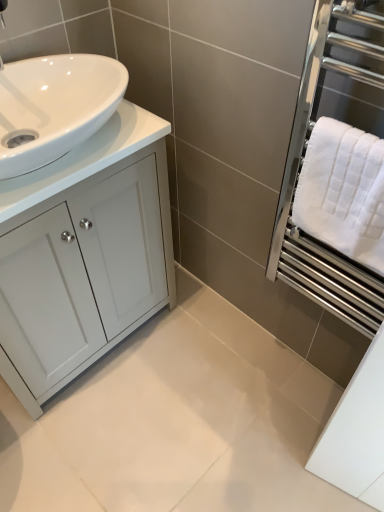
Locate an element on the screen. This screenshot has width=384, height=512. white glossy countertop at left is located at coordinates (84, 158).

The image size is (384, 512). Describe the element at coordinates (343, 191) in the screenshot. I see `white textured towel at right` at that location.

You are a GUI agent. You are given a task and a screenshot of the screen. Output one action in this format:
    pyautogui.click(x=<x>, y=<y>)
    Task: Click on the white glossy cabinet at left
    
    Given the screenshot: What is the action you would take?
    pyautogui.click(x=84, y=254)

Where is `bathroom cabinet behind the white textured towel at right`? bathroom cabinet behind the white textured towel at right is located at coordinates (84, 254).

Is white glossy cabinet at left oriented away from white textured towel at right?

white glossy cabinet at left does not have its back to white textured towel at right.

Does point (53, 181) come behind point (315, 128)?

Yes, point (53, 181) is behind point (315, 128).

Considering the relative positions of white glossy cabinet at left and white textured towel at right in the image provided, is white glossy cabinet at left in front of white textured towel at right?

No, white glossy cabinet at left is further to the viewer.

Looking at this image, is white glossy countertop at left further to camera compared to white textured towel at right?

Yes, white glossy countertop at left is further from the viewer.

From a real-world perspective, does white glossy countertop at left stand above white textured towel at right?

Correct, in the physical world, white glossy countertop at left is higher than white textured towel at right.

Does point (93, 141) appear closer or farther from the camera than point (362, 330)?

Point (93, 141) is closer to the camera than point (362, 330).

The height and width of the screenshot is (512, 384). Identify the location of screen door to the right of white glossy cabinet at left. (305, 154).

Considering the sizes of objects white glossy cabinet at left and white textured towel at right in the image provided, who is taller, white glossy cabinet at left or white textured towel at right?

white glossy cabinet at left.

From a real-world perspective, which object rests below the other?

white glossy cabinet at left is physically lower.

From the image's perspective, is white glossy cabinet at left under white textured towel at right?

Yes, from the image's perspective, white glossy cabinet at left is beneath white textured towel at right.

Does point (294, 134) lie in front of point (145, 249)?

Yes.

Considering the relative sizes of white textured towel at right and white glossy cabinet at left in the image provided, is white textured towel at right smaller than white glossy cabinet at left?

Yes.

Is white textured towel at right closer to the viewer compared to white glossy cabinet at left?

Yes, white textured towel at right is closer to the camera.

Between white textured towel at right and white glossy cabinet at left, which one has smaller width?

white textured towel at right is thinner.

Is white textured towel at right facing towards white glossy cabinet at left?

No, white textured towel at right is not oriented towards white glossy cabinet at left.

Is white textured towel at right spatially inside white glossy cabinet at left, or outside of it?

white textured towel at right is not inside white glossy cabinet at left, it's outside.

Is white glossy countertop at left surrounded by white glossy cabinet at left?

No, white glossy countertop at left is not inside white glossy cabinet at left.

From a real-world perspective, is white glossy cabinet at left above or below white glossy countertop at left?

In terms of real-world spatial position, white glossy cabinet at left is below white glossy countertop at left.

Where is `counter top above the white glossy cabinet at left (from a real-world perspective)`? The image size is (384, 512). counter top above the white glossy cabinet at left (from a real-world perspective) is located at coordinates (84, 158).

Is white textured towel at right positioned with its back to white glossy countertop at left?

No, white glossy countertop at left is not at the back of white textured towel at right.

You are a GUI agent. You are given a task and a screenshot of the screen. Output one action in this format:
    pyautogui.click(x=<x>, y=<y>)
    Task: Click on the screen door on the right of white glossy countertop at left
    Image resolution: width=384 pixels, height=512 pixels.
    Given the screenshot: What is the action you would take?
    pyautogui.click(x=305, y=154)

Do you think white textured towel at right is within white glossy countertop at left, or outside of it?

white textured towel at right is located beyond the bounds of white glossy countertop at left.

Locate an element on the screen. This screenshot has height=512, width=384. bathroom cabinet lying on the left of white textured towel at right is located at coordinates (84, 254).

Locate an element on the screen. Image resolution: width=384 pixels, height=512 pixels. screen door below the white glossy countertop at left (from the image's perspective) is located at coordinates (305, 154).

Estimate the real-world distances between objects in this image. Which object is further from white textured towel at right, white textured towel at right or white glossy countertop at left?

white glossy countertop at left lies further to white textured towel at right than the other object.

Estimate the real-world distances between objects in this image. Which object is closer to white textured towel at right, white glossy countertop at left or white textured towel at right?

white textured towel at right is positioned closer to the anchor white textured towel at right.

When comparing their distances from white glossy cabinet at left, does white glossy countertop at left or white textured towel at right seem further?

Among the two, white textured towel at right is located further to white glossy cabinet at left.

Which object lies further to the anchor point white textured towel at right, white textured towel at right or white glossy countertop at left?

white glossy countertop at left lies further to white textured towel at right than the other object.

Which object lies further to the anchor point white textured towel at right, white glossy cabinet at left or white glossy countertop at left?

Based on the image, white glossy cabinet at left appears to be further to white textured towel at right.

Which object lies further to the anchor point white textured towel at right, white glossy cabinet at left or white textured towel at right?

white glossy cabinet at left is further to white textured towel at right.

Looking at the image, which one is located closer to white glossy cabinet at left, white textured towel at right or white glossy countertop at left?

white glossy countertop at left.

Looking at this image, considering their positions, is white glossy cabinet at left positioned further to white textured towel at right than white glossy countertop at left?

white glossy cabinet at left is further to white textured towel at right.

Locate an element on the screen. The width and height of the screenshot is (384, 512). bath towel situated between white glossy cabinet at left and white textured towel at right from left to right is located at coordinates (343, 191).

At what (x,y) coordinates should I click in order to perform the action: click on bath towel located between white glossy countertop at left and white textured towel at right in the left-right direction. Please return your answer as a coordinate pair (x, y). This screenshot has height=512, width=384. Looking at the image, I should click on (343, 191).

You are a GUI agent. You are given a task and a screenshot of the screen. Output one action in this format:
    pyautogui.click(x=<x>, y=<y>)
    Task: Click on the counter top between white glossy cabinet at left and white textured towel at right in the horizontal direction
    
    Given the screenshot: What is the action you would take?
    (84, 158)

Locate an element on the screen. The width and height of the screenshot is (384, 512). counter top situated between white glossy cabinet at left and white textured towel at right from left to right is located at coordinates (84, 158).